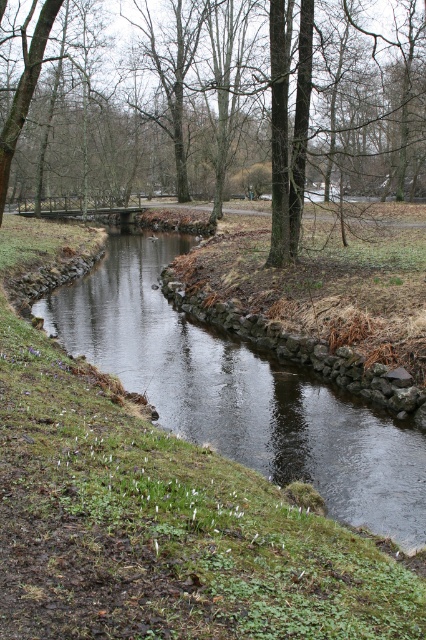
Between brown bark tree at center and dark gray stone stream at center, which one is positioned lower?

dark gray stone stream at center

How distant is brown bark tree at center from dark gray stone stream at center?

They are 91.02 feet apart.

Is point (261, 44) closer to camera compared to point (340, 408)?

That is False.

The height and width of the screenshot is (640, 426). Find the location of `brown bark tree at center`. brown bark tree at center is located at coordinates (215, 106).